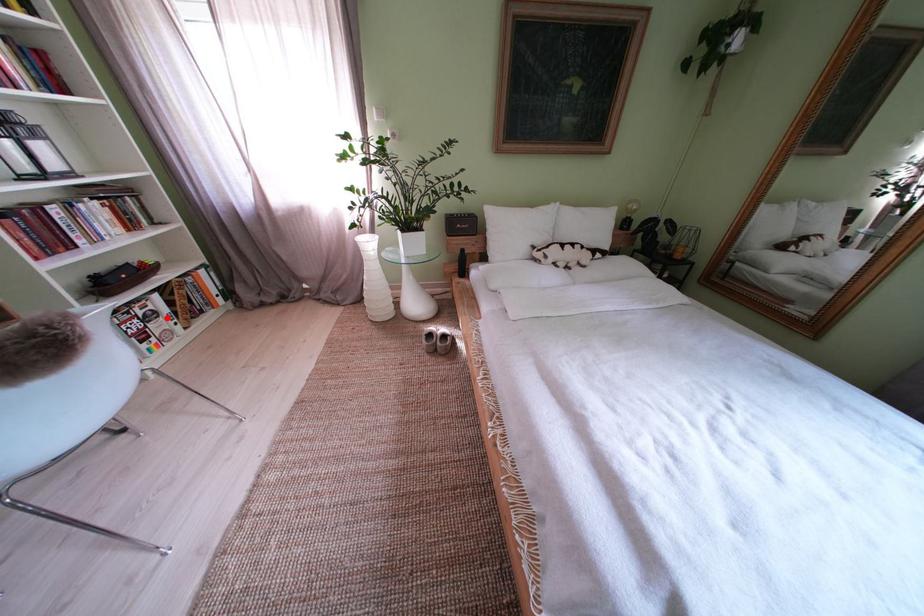
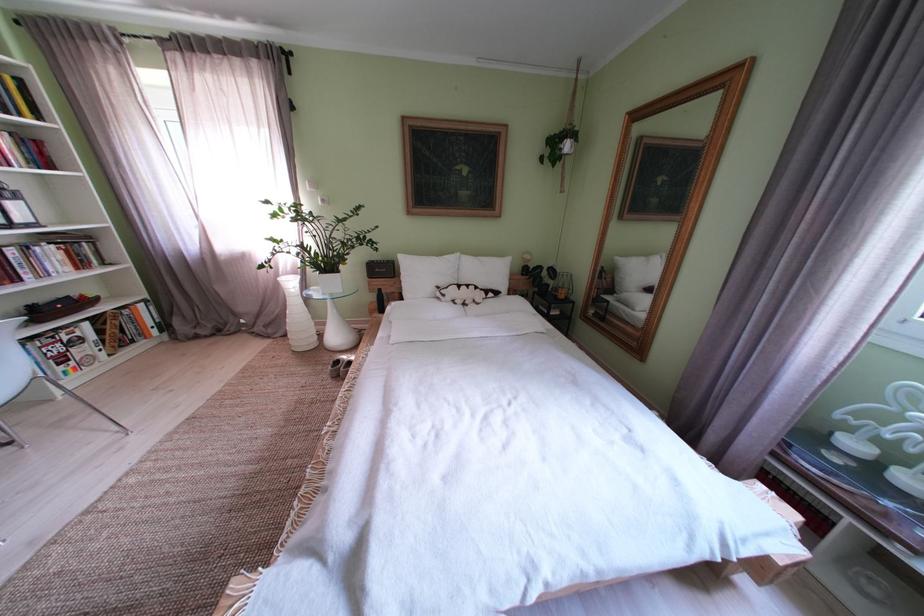
Question: I am providing you with two images of the same scene from different viewpoints. A red point is marked on the first image. Can you still see the location of the red point in image 2?

Choices:
 (A) Yes
 (B) No

Answer: (A)